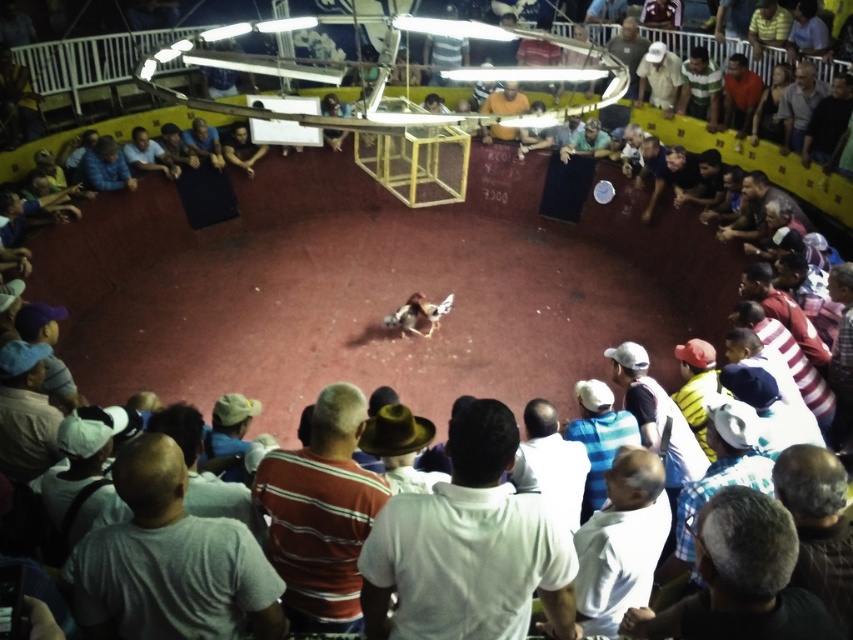
Is white cotton shirt at center to the left of white cotton shirt at upper right from the viewer's perspective?

Indeed, white cotton shirt at center is positioned on the left side of white cotton shirt at upper right.

Does point (494, 573) come closer to viewer compared to point (666, 88)?

Yes, it is.

This screenshot has height=640, width=853. Find the location of `white cotton shirt at center`. white cotton shirt at center is located at coordinates (468, 547).

The image size is (853, 640). I want to click on white cotton shirt at center, so click(468, 547).

Who is more forward, [650,51] or [146,157]?

Positioned in front is point [146,157].

Can you confirm if white cotton shirt at upper right is positioned to the left of matte black shirt at upper left?

No, white cotton shirt at upper right is not to the left of matte black shirt at upper left.

Measure the distance between point (679, 61) and camera.

Point (679, 61) and camera are 8.50 meters apart.

This screenshot has width=853, height=640. In order to click on white cotton shirt at upper right in this screenshot , I will do `click(659, 77)`.

Which is below, white cotton shirt at upper right or orange shirt at upper right?

orange shirt at upper right

Is white cotton shirt at upper right smaller than orange shirt at upper right?

Actually, white cotton shirt at upper right might be larger than orange shirt at upper right.

Between point (648, 102) and point (740, 113), which one is positioned in front?

Point (740, 113) is more forward.

Identify the location of white cotton shirt at upper right. (659, 77).